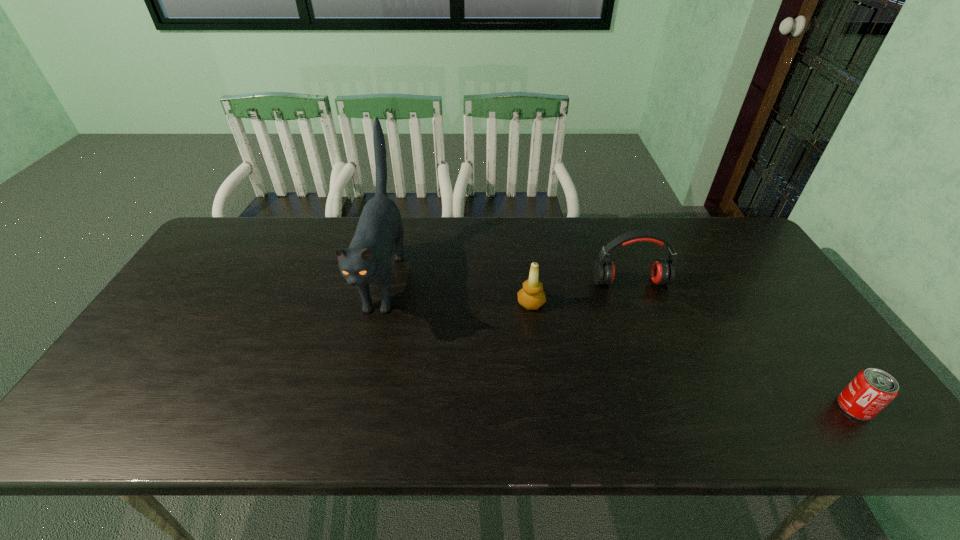
At what (x,y) coordinates should I click in order to perform the action: click on vacant space at the far right corner. Please return your answer as a coordinate pair (x, y). Image resolution: width=960 pixels, height=540 pixels. Looking at the image, I should click on (695, 221).

I want to click on free area in between the rightmost object and the cat, so click(619, 343).

Find the location of `free space between the earphone and the candle_holder`. free space between the earphone and the candle_holder is located at coordinates (581, 293).

Where is `vacant area that lies between the rightmost object and the tallest object`? vacant area that lies between the rightmost object and the tallest object is located at coordinates (619, 343).

Locate an element on the screen. vacant space that's between the rightmost object and the tallest object is located at coordinates (619, 343).

You are a GUI agent. You are given a task and a screenshot of the screen. Output one action in this format:
    pyautogui.click(x=<x>, y=<y>)
    Task: Click on the free space between the shortest object and the cat
    This screenshot has width=960, height=540.
    Given the screenshot: What is the action you would take?
    pyautogui.click(x=619, y=343)

At what (x,y) coordinates should I click in order to perform the action: click on free point between the rightmost object and the second object from left to right. Please return your answer as a coordinate pair (x, y). The width and height of the screenshot is (960, 540). Looking at the image, I should click on (693, 355).

Locate an element on the screen. The width and height of the screenshot is (960, 540). free space between the tallest object and the second object from right to left is located at coordinates (507, 281).

Find the location of `vacant point located between the candle_holder and the nearest object`. vacant point located between the candle_holder and the nearest object is located at coordinates (693, 355).

The width and height of the screenshot is (960, 540). Identify the location of vacant space that is in between the nearest object and the tallest object. (619, 343).